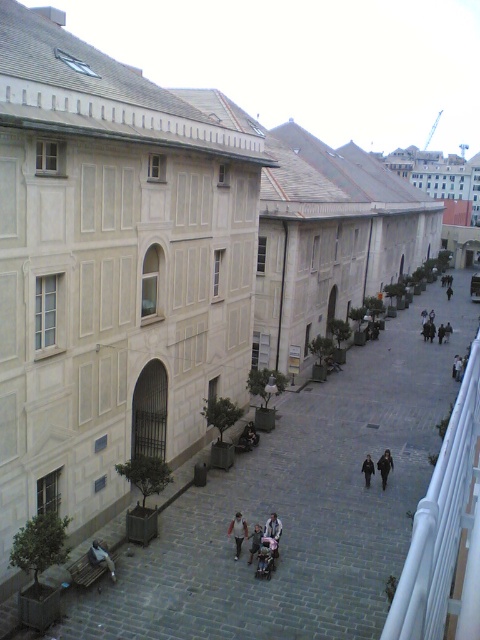
Question: Which point is farther from the camera taking this photo?

Choices:
 (A) (368, 461)
 (B) (259, 541)
 (C) (381, 465)

Answer: (C)

Question: Does dark gray fabric coat at center appear over dark gray coat at lower center?

Choices:
 (A) no
 (B) yes

Answer: (A)

Question: Estimate the real-world distances between objects in this image. Which object is closer to the dark gray fabric coat at center?

Choices:
 (A) light blue denim jacket at center
 (B) light brown leather jacket at lower center
 (C) black fabric person at center

Answer: (A)

Question: Is light blue denim jacket at center thinner than dark gray coat at lower center?

Choices:
 (A) yes
 (B) no

Answer: (B)

Question: Which point is farther to the camera?

Choices:
 (A) coord(379,465)
 (B) coord(231,532)

Answer: (A)

Question: Can you confirm if dark gray coat at lower center is positioned below dark gray fabric jacket at center?

Choices:
 (A) no
 (B) yes

Answer: (A)